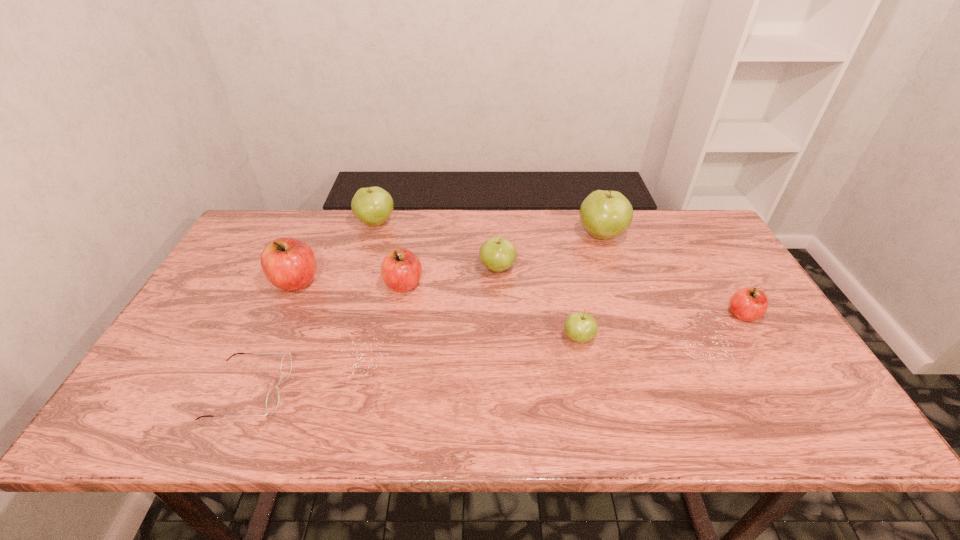
Where is `free space that satisfies the following two spatial constraints: 1. on the front side of the leftmost green apple; 2. on the left side of the fourth apple from right to left`? free space that satisfies the following two spatial constraints: 1. on the front side of the leftmost green apple; 2. on the left side of the fourth apple from right to left is located at coordinates (362, 268).

Find the location of a particular element. The image size is (960, 540). vacant area that satisfies the following two spatial constraints: 1. on the back side of the leftmost apple; 2. on the left side of the tallest object is located at coordinates (317, 235).

Image resolution: width=960 pixels, height=540 pixels. In order to click on free location that satisfies the following two spatial constraints: 1. on the back side of the rightmost object; 2. on the right side of the nearest green apple in this screenshot , I will do `click(573, 314)`.

Locate an element on the screen. This screenshot has height=540, width=960. vacant space that satisfies the following two spatial constraints: 1. on the front side of the nearest red apple; 2. on the left side of the fifth object from left to right is located at coordinates (499, 314).